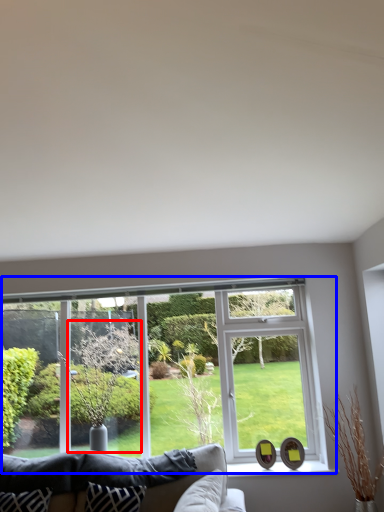
Question: Which object appears farthest to the camera in this image, tree (highlighted by a red box) or window (highlighted by a blue box)?

Choices:
 (A) tree
 (B) window

Answer: (B)